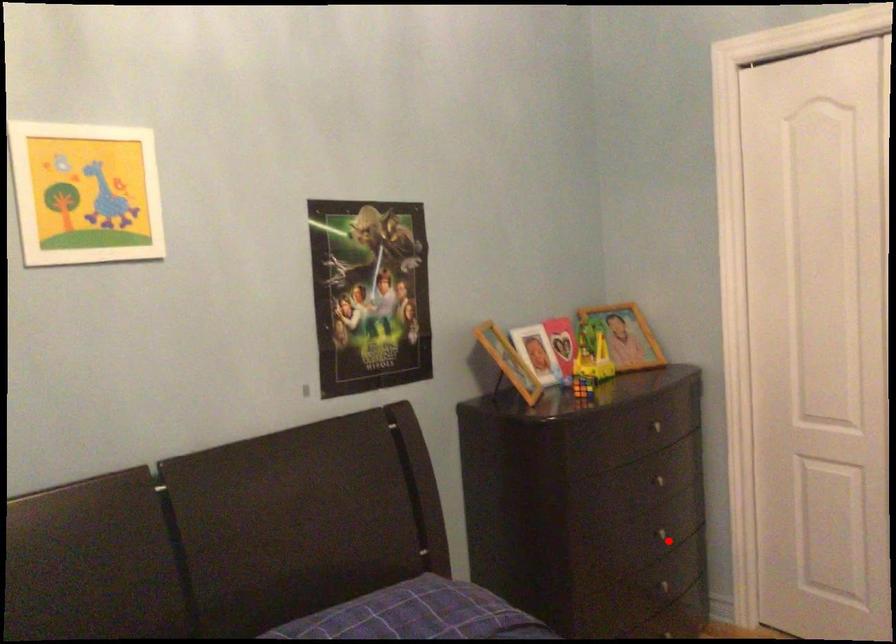
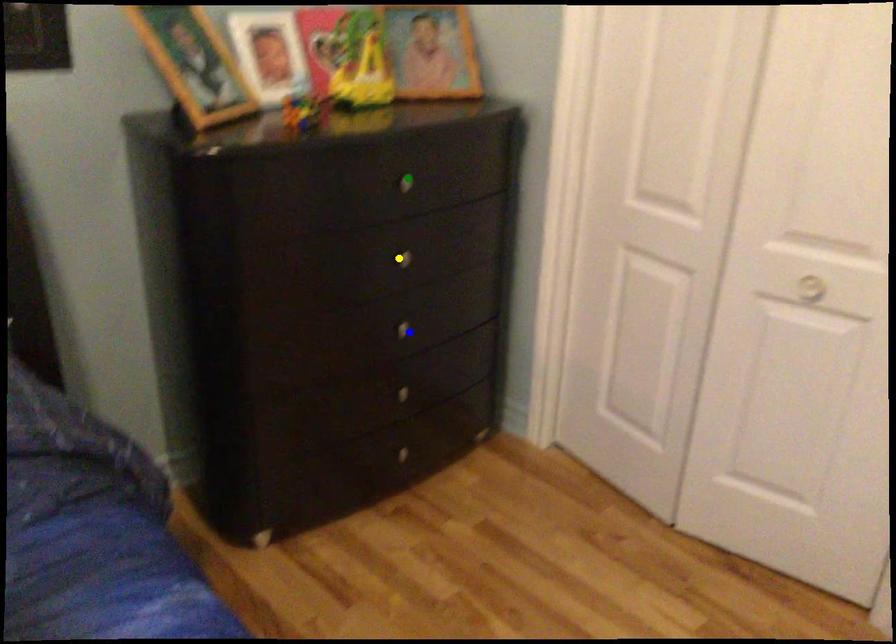
Question: I am providing you with two images of the same scene from different viewpoints. A red point is marked on the first image. You are given multiple points on the second image. Can you choose the point in image 2 that corresponds to the point in image 1?

Choices:
 (A) blue point
 (B) green point
 (C) yellow point

Answer: (A)